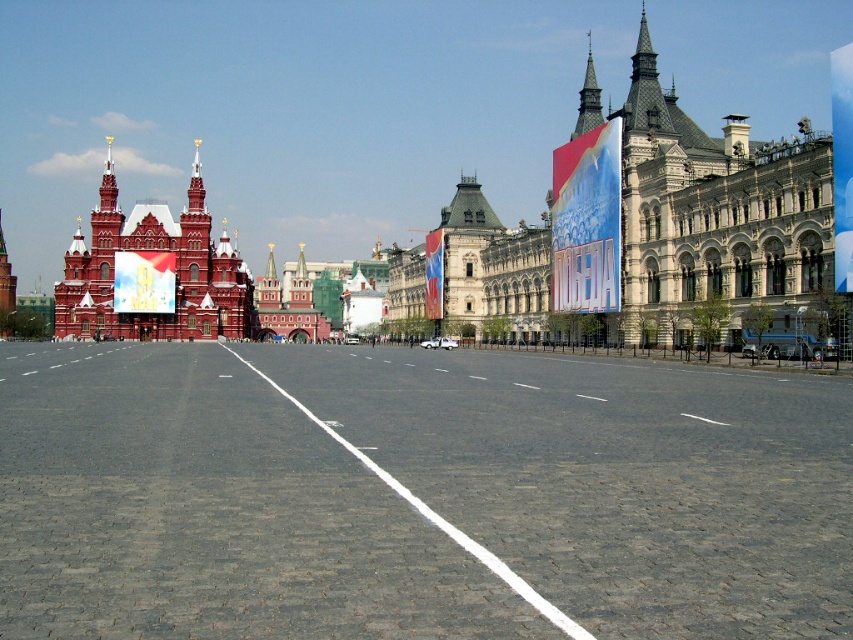
Question: Considering the real-world distances, which object is farthest from the polished brass spire at upper right?

Choices:
 (A) matte red palace at left
 (B) gray cobblestone plaza at center

Answer: (A)

Question: Can you confirm if gray cobblestone plaza at center is wider than matte red palace at left?

Choices:
 (A) no
 (B) yes

Answer: (B)

Question: Can you confirm if matte red palace at left is positioned to the right of polished brass spire at upper right?

Choices:
 (A) no
 (B) yes

Answer: (A)

Question: Which point is farther to the camera?

Choices:
 (A) (567, 477)
 (B) (149, 209)

Answer: (B)

Question: Which object is the closest to the polished brass spire at upper right?

Choices:
 (A) matte red palace at left
 (B) gray cobblestone plaza at center

Answer: (B)

Question: Does gray cobblestone plaza at center come in front of matte red palace at left?

Choices:
 (A) no
 (B) yes

Answer: (B)